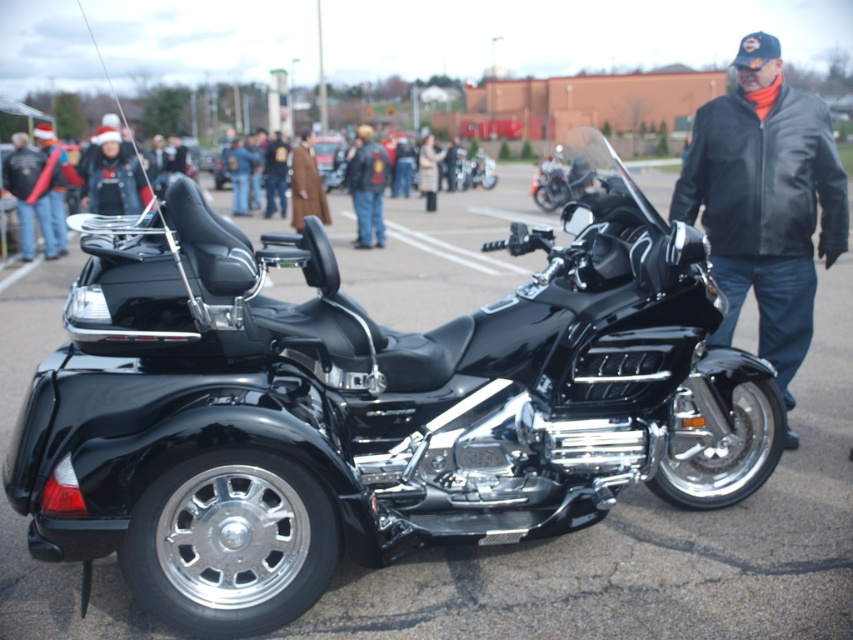
You are a photographer standing at the front of the parking lot. You want to take a photo of both the black polished trike at center and the leather jacket at center. Which object should you focus on first to ensure it appears larger in the photo?

The black polished trike at center is closer to the viewer than the leather jacket at center, so focusing on it first will make it appear larger in the photo.

You are a photographer standing at the edge of the parking lot where the black polished trike at center is parked. You want to take a photo of the trike with a camera that has a maximum focus range of 10 feet. Will you be able to focus on the trike from your current position?

The black polished trike at center and the camera are 11.56 feet apart, which exceeds the camera maximum focus range of 10 feet. Therefore, you won not be able to focus on the trike from your current position.